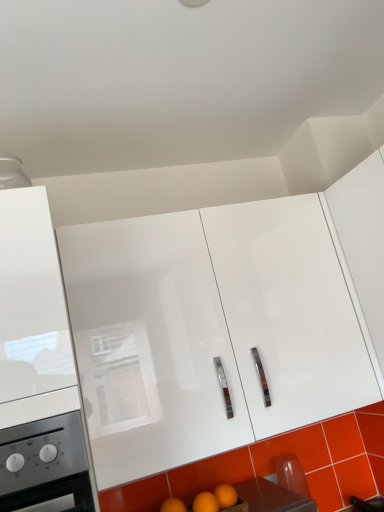
Image resolution: width=384 pixels, height=512 pixels. What do you see at coordinates (355, 478) in the screenshot? I see `orange glossy tile at lower right` at bounding box center [355, 478].

I want to click on white glossy cabinet at upper right, acting as the 1th cabinetry starting from the right, so click(362, 247).

Measure the distance between point (293, 492) and camera.

A distance of 4.80 feet exists between point (293, 492) and camera.

Where is `orange glossy tile at lower right`? The height and width of the screenshot is (512, 384). orange glossy tile at lower right is located at coordinates (355, 478).

Does orange glossy tile at lower right lie behind white glossy cabinet at left, the 3th cabinetry positioned from the right?

Yes, it is.

What's the angular difference between orange glossy tile at lower right and white glossy cabinet at left, the 3th cabinetry positioned from the right,'s facing directions?

The angle between the facing direction of orange glossy tile at lower right and the facing direction of white glossy cabinet at left, the 3th cabinetry positioned from the right, is 0.00207 degrees.

Is white glossy cabinet at left, the 3th cabinetry positioned from the right, at the back of orange glossy tile at lower right?

No, white glossy cabinet at left, the 3th cabinetry positioned from the right, is not at the back of orange glossy tile at lower right.

Do you think white glossy cabinet at center, placed as the 2th cabinetry when sorted from right to left, is within white glossy cabinet at left, the 3th cabinetry positioned from the right, or outside of it?

white glossy cabinet at center, placed as the 2th cabinetry when sorted from right to left, exists outside the volume of white glossy cabinet at left, the 3th cabinetry positioned from the right.

How different are the orientations of white glossy cabinet at center, placed as the 2th cabinetry when sorted from right to left, and white glossy cabinet at left, the 3th cabinetry positioned from the right, in degrees?

The facing directions of white glossy cabinet at center, placed as the 2th cabinetry when sorted from right to left, and white glossy cabinet at left, the 3th cabinetry positioned from the right, are 0.000363 degrees apart.

From a real-world perspective, who is located lower, white glossy cabinet at center, which is the second cabinetry in left-to-right order, or white glossy cabinet at left, the 1th cabinetry positioned from the left?

white glossy cabinet at center, which is the second cabinetry in left-to-right order.

Does point (307, 510) appear closer or farther from the camera than point (201, 224)?

Point (307, 510).

From a real-world perspective, which object stands above the other?

In real-world perspective, white glossy cabinet at center, placed as the 2th cabinetry when sorted from right to left, is above.

From the image's perspective, who appears lower, orange matte wood at lower center or white glossy cabinet at center, placed as the 2th cabinetry when sorted from right to left?

orange matte wood at lower center.

How distant is orange matte wood at lower center from white glossy cabinet at upper right, the third cabinetry when ordered from left to right?

They are 32.59 inches apart.

Is orange matte wood at lower center next to white glossy cabinet at upper right, acting as the 1th cabinetry starting from the right, and touching it?

orange matte wood at lower center and white glossy cabinet at upper right, acting as the 1th cabinetry starting from the right, are clearly separated.

From a real-world perspective, is orange matte wood at lower center physically located above or below white glossy cabinet at upper right, the third cabinetry when ordered from left to right?

orange matte wood at lower center is below white glossy cabinet at upper right, the third cabinetry when ordered from left to right.

Considering the positions of points (379, 210) and (248, 244), is point (379, 210) closer to camera compared to point (248, 244)?

Yes.

From a real-world perspective, is white glossy cabinet at upper right, the third cabinetry when ordered from left to right, over white glossy cabinet at center, which is the second cabinetry in left-to-right order?

Yes, from a real-world perspective, white glossy cabinet at upper right, the third cabinetry when ordered from left to right, is over white glossy cabinet at center, which is the second cabinetry in left-to-right order

Considering the relative sizes of white glossy cabinet at upper right, acting as the 1th cabinetry starting from the right, and white glossy cabinet at center, placed as the 2th cabinetry when sorted from right to left, in the image provided, is white glossy cabinet at upper right, acting as the 1th cabinetry starting from the right, taller than white glossy cabinet at center, placed as the 2th cabinetry when sorted from right to left,?

Correct, white glossy cabinet at upper right, acting as the 1th cabinetry starting from the right, is much taller as white glossy cabinet at center, placed as the 2th cabinetry when sorted from right to left.

Between white glossy cabinet at upper right, acting as the 1th cabinetry starting from the right, and white glossy cabinet at center, which is the second cabinetry in left-to-right order, which one is positioned behind?

white glossy cabinet at center, which is the second cabinetry in left-to-right order, is more distant.

Which object is closer to the camera taking this photo, white glossy cabinet at left, the 3th cabinetry positioned from the right, or orange glossy tile at lower right?

white glossy cabinet at left, the 3th cabinetry positioned from the right, is in front.

Can you see white glossy cabinet at left, the 1th cabinetry positioned from the left, touching orange glossy tile at lower right?

No.

Is white glossy cabinet at left, the 3th cabinetry positioned from the right, aimed at orange glossy tile at lower right?

No, white glossy cabinet at left, the 3th cabinetry positioned from the right, is not facing towards orange glossy tile at lower right.

Which of these two, orange glossy tile at lower right or white glossy cabinet at upper right, the third cabinetry when ordered from left to right, stands taller?

Standing taller between the two is white glossy cabinet at upper right, the third cabinetry when ordered from left to right.

From a real-world perspective, between orange glossy tile at lower right and white glossy cabinet at upper right, acting as the 1th cabinetry starting from the right, who is vertically higher?

white glossy cabinet at upper right, acting as the 1th cabinetry starting from the right, from a real-world perspective.

Is orange glossy tile at lower right behind white glossy cabinet at upper right, acting as the 1th cabinetry starting from the right?

That is True.

Which is more to the left, orange glossy tile at lower right or white glossy cabinet at upper right, the third cabinetry when ordered from left to right?

orange glossy tile at lower right.

The image size is (384, 512). What are the coordinates of `tile on the right of the white glossy cabinet at left, the 3th cabinetry positioned from the right` in the screenshot? It's located at [355, 478].

In order to click on the 1st cabinetry above the white glossy cabinet at center, placed as the 2th cabinetry when sorted from right to left (from the image's perspective) in this screenshot , I will do `click(37, 368)`.

In the scene shown: Based on their spatial positions, is white glossy cabinet at center, which is the second cabinetry in left-to-right order, or orange glossy tile at lower right closer to white glossy cabinet at upper right, acting as the 1th cabinetry starting from the right?

white glossy cabinet at center, which is the second cabinetry in left-to-right order.

Estimate the real-world distances between objects in this image. Which object is closer to white glossy cabinet at upper right, acting as the 1th cabinetry starting from the right, white glossy cabinet at left, the 3th cabinetry positioned from the right, or orange matte wood at lower center?

Based on the image, orange matte wood at lower center appears to be nearer to white glossy cabinet at upper right, acting as the 1th cabinetry starting from the right.

From the picture: When comparing their distances from orange matte wood at lower center, does white glossy cabinet at center, which is the second cabinetry in left-to-right order, or white glossy cabinet at upper right, acting as the 1th cabinetry starting from the right, seem closer?

Among the two, white glossy cabinet at center, which is the second cabinetry in left-to-right order, is located nearer to orange matte wood at lower center.

Based on their spatial positions, is white glossy cabinet at left, the 3th cabinetry positioned from the right, or white glossy cabinet at center, which is the second cabinetry in left-to-right order, closer to white glossy cabinet at upper right, the third cabinetry when ordered from left to right?

white glossy cabinet at center, which is the second cabinetry in left-to-right order, lies closer to white glossy cabinet at upper right, the third cabinetry when ordered from left to right, than the other object.

Looking at the image, which one is located further to orange matte wood at lower center, orange glossy tile at lower right or white glossy cabinet at center, which is the second cabinetry in left-to-right order?

white glossy cabinet at center, which is the second cabinetry in left-to-right order.

In the scene shown: Based on their spatial positions, is white glossy cabinet at left, the 3th cabinetry positioned from the right, or white glossy cabinet at upper right, the third cabinetry when ordered from left to right, closer to orange matte wood at lower center?

Based on the image, white glossy cabinet at left, the 3th cabinetry positioned from the right, appears to be nearer to orange matte wood at lower center.

When comparing their distances from white glossy cabinet at upper right, the third cabinetry when ordered from left to right, does orange matte wood at lower center or orange glossy tile at lower right seem closer?

Answer: orange glossy tile at lower right is closer to white glossy cabinet at upper right, the third cabinetry when ordered from left to right.

Estimate the real-world distances between objects in this image. Which object is closer to white glossy cabinet at left, the 1th cabinetry positioned from the left, white glossy cabinet at upper right, the third cabinetry when ordered from left to right, or orange glossy tile at lower right?

The object closer to white glossy cabinet at left, the 1th cabinetry positioned from the left, is white glossy cabinet at upper right, the third cabinetry when ordered from left to right.

The height and width of the screenshot is (512, 384). I want to click on tile located between white glossy cabinet at left, the 1th cabinetry positioned from the left, and white glossy cabinet at upper right, acting as the 1th cabinetry starting from the right, in the left-right direction, so tap(355, 478).

The width and height of the screenshot is (384, 512). I want to click on cabinetry situated between orange matte wood at lower center and orange glossy tile at lower right from left to right, so click(x=209, y=331).

Where is `cabinetry situated between white glossy cabinet at left, the 3th cabinetry positioned from the right, and white glossy cabinet at upper right, acting as the 1th cabinetry starting from the right, from left to right`? Image resolution: width=384 pixels, height=512 pixels. cabinetry situated between white glossy cabinet at left, the 3th cabinetry positioned from the right, and white glossy cabinet at upper right, acting as the 1th cabinetry starting from the right, from left to right is located at coordinates (209, 331).

In order to click on cabinetry situated between orange matte wood at lower center and white glossy cabinet at upper right, the third cabinetry when ordered from left to right, from left to right in this screenshot , I will do `click(209, 331)`.